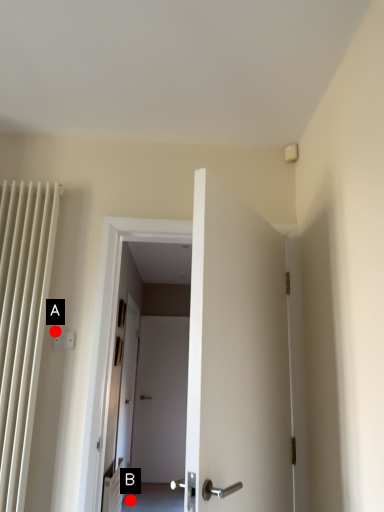
Question: Two points are circled on the image, labeled by A and B beside each circle. Which point appears closest to the camera in this image?

Choices:
 (A) A is closer
 (B) B is closer

Answer: (A)